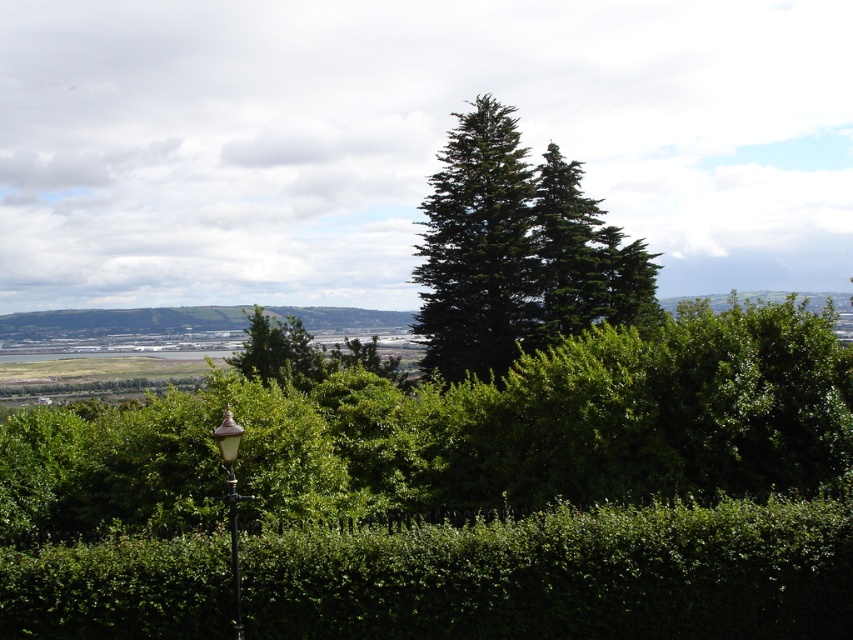
You are standing in the serene landscape scene described. You want to place a new bench exactly at the point marked as point (485, 314). Considering the dense hedge in the lower part of the frame, will the bench be visible from where you are standing?

The point (485, 314) is 139.52 feet away from the viewer. Since the dense hedge runs horizontally across the lower part of the frame, it may block the view depending on the bench height and hedge height. However, without specific hedge height data, we can infer that at 139.52 feet distance, the bench might be visible above the hedge if placed appropriately.